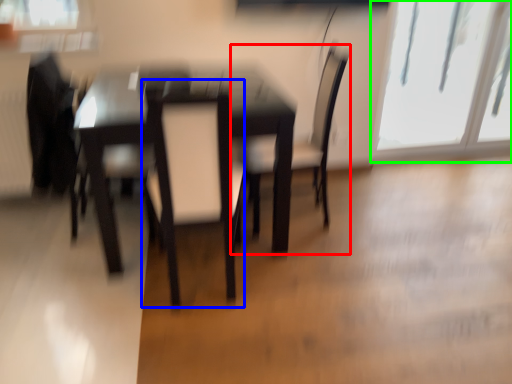
Question: Based on their relative distances, which object is nearer to chair (highlighted by a red box)? Choose from swivel chair (highlighted by a blue box) and window (highlighted by a green box).

Choices:
 (A) swivel chair
 (B) window

Answer: (A)